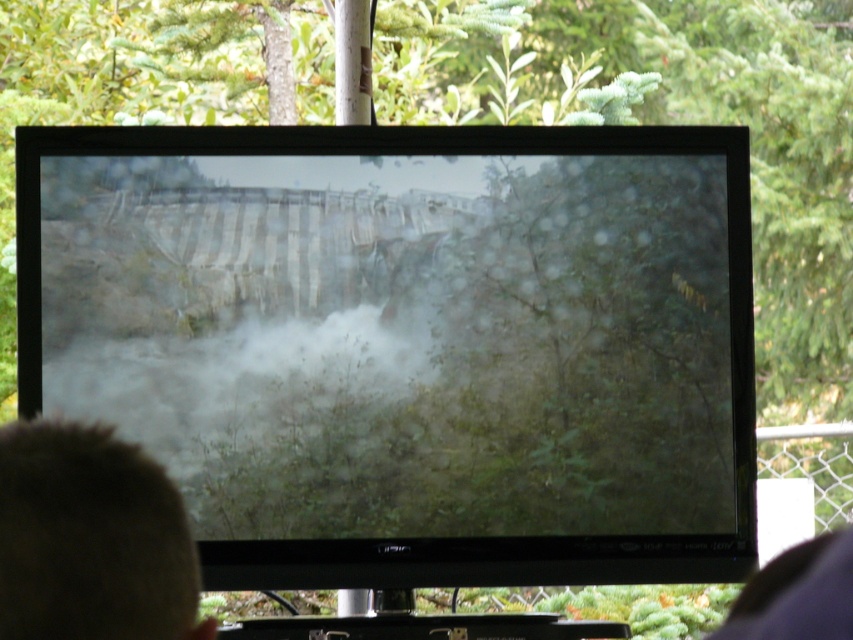
Question: Does matte black monitor at center come behind brown fuzzy hair at lower left?

Choices:
 (A) yes
 (B) no

Answer: (A)

Question: Which of the following is the farthest from the observer?

Choices:
 (A) (99, 484)
 (B) (548, 188)

Answer: (B)

Question: Is matte black monitor at center bigger than brown fuzzy hair at lower left?

Choices:
 (A) no
 (B) yes

Answer: (B)

Question: Which of the following is the farthest from the observer?

Choices:
 (A) (93, 180)
 (B) (165, 509)

Answer: (A)

Question: Observing the image, what is the correct spatial positioning of matte black monitor at center in reference to brown fuzzy hair at lower left?

Choices:
 (A) above
 (B) below

Answer: (A)